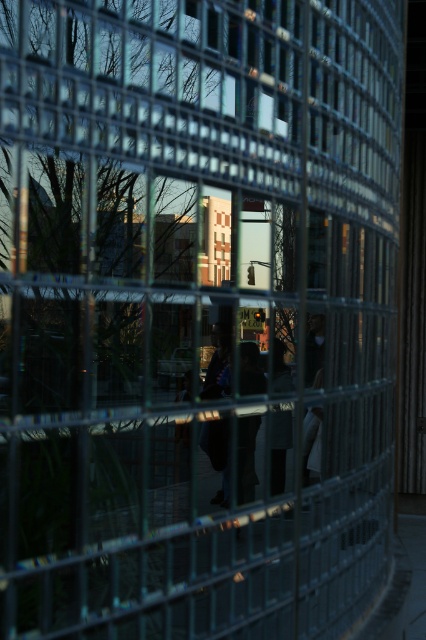
I want to click on dark fabric figure at center, so click(247, 458).

Does dark fabric figure at center appear over dark gray fabric at center?

Yes, dark fabric figure at center is above dark gray fabric at center.

Which is in front, point (253, 349) or point (279, 474)?

Point (253, 349) is in front.

Where is `dark fabric figure at center`? dark fabric figure at center is located at coordinates (247, 458).